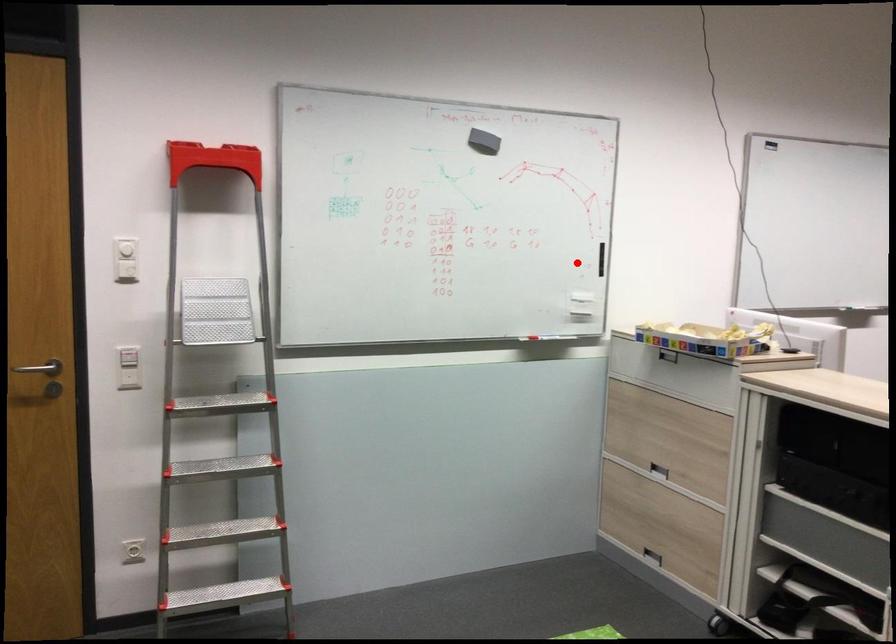
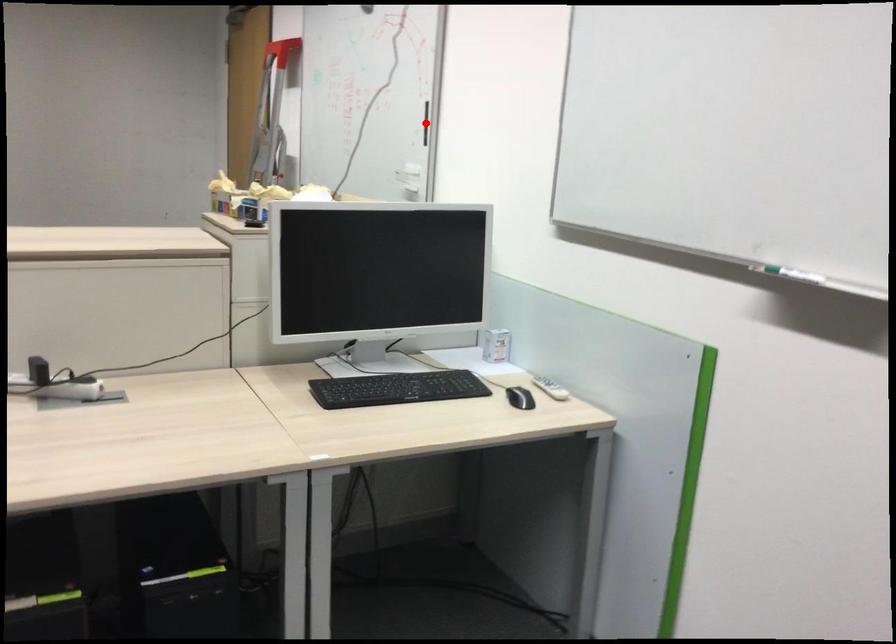
I am providing you with two images of the same scene from different viewpoints. A red point is marked on the first image and another point is marked on the second image. Is the red point in image1 aligned with the point shown in image2?

Yes